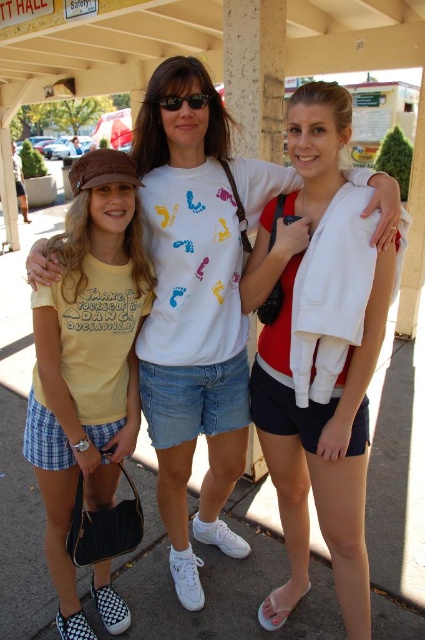
Please describe the position of the white cotton jacket at center in terms of coordinates. The coordinates are normalized between 0 and 1, where 0,0 is the bottom left corner and 1,1 is the top right corner. The scene is three people at a bus stop. The people are wearing a yellow Tshirt, white cotton jacket, and a blue sweater. The jacket is between two people. The jacket is at the center of the image. The jacket is worn by a person. The jacket has a collar and is buttoned up.

The white cotton jacket at center is located at coordinates approximately 0.598 in the x axis and 0.784 in the y axis.